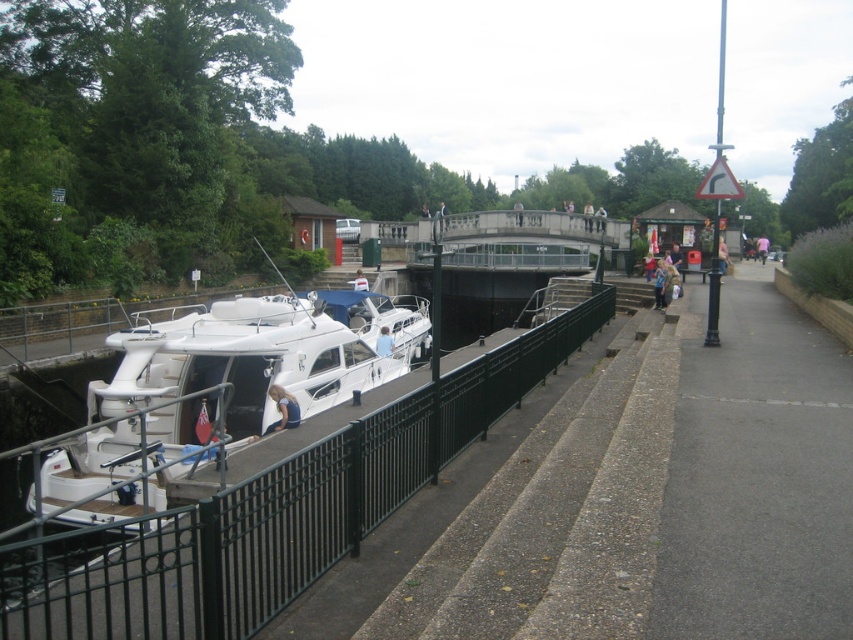
You are planning to place a small potted plant between the blue fabric shirt at lower left and the blue denim jacket at lower right. Which object should you position the plant closer to to ensure it fits within the available space?

The blue fabric shirt at lower left occupies less space than the blue denim jacket at lower right, so you should position the plant closer to the blue denim jacket at lower right to accommodate the plant within the available space.

You are standing on the walkway and want to move from the black metal fence at lower left to the blue denim jacket at lower right. Which direction should you move to get there?

You should move to the right because the black metal fence at lower left is positioned on the left side of the blue denim jacket at lower right, so moving right will take you towards it.